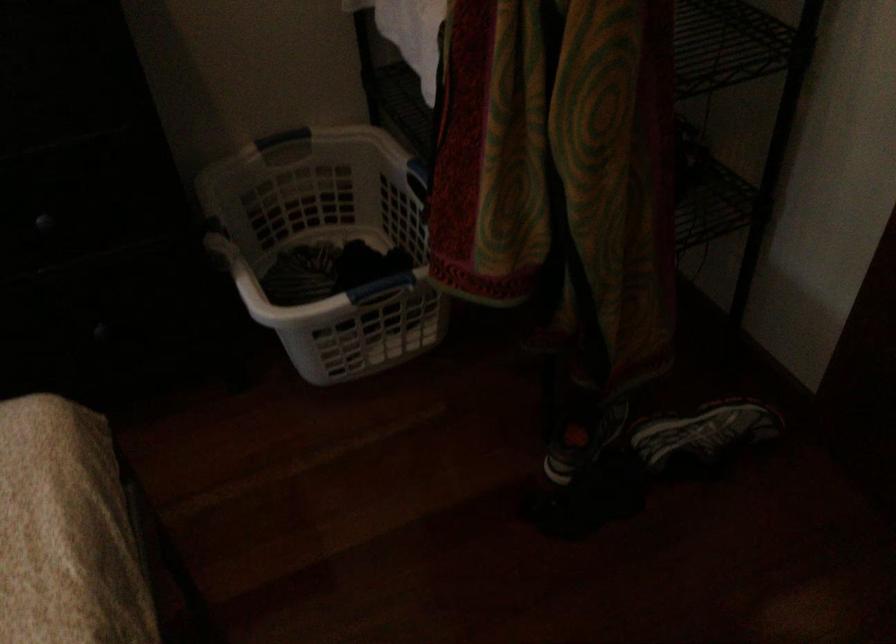
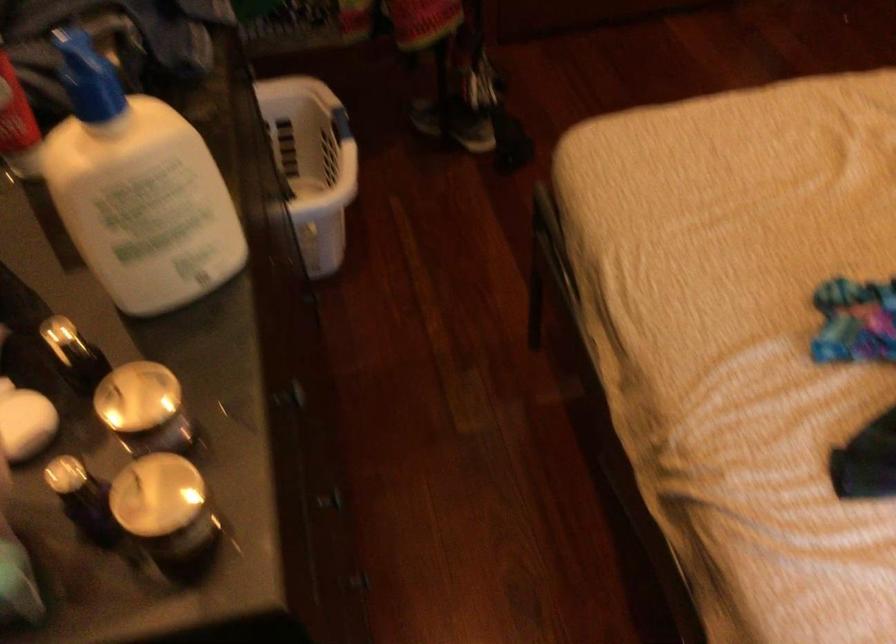
Where in the second image is the point corresponding to point (443, 316) from the first image?

(312, 164)